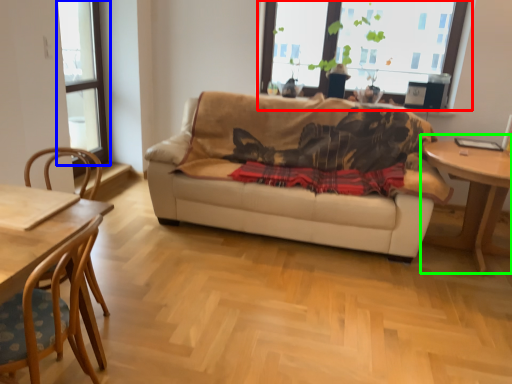
Question: Which is nearer to the window (highlighted by a red box)? window (highlighted by a blue box) or table (highlighted by a green box).

Choices:
 (A) window
 (B) table

Answer: (B)